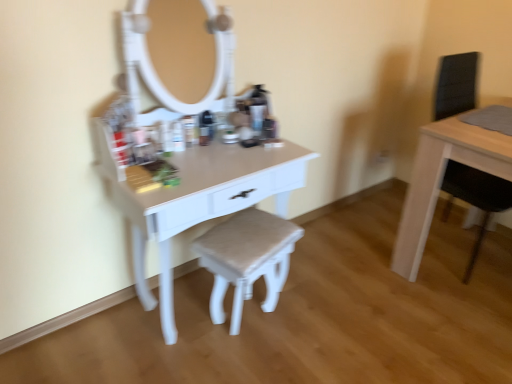
Image resolution: width=512 pixels, height=384 pixels. Identify the location of vacant space that's between matte white stool at center and light wood table at right, the 2th table in the left-to-right sequence. (350, 288).